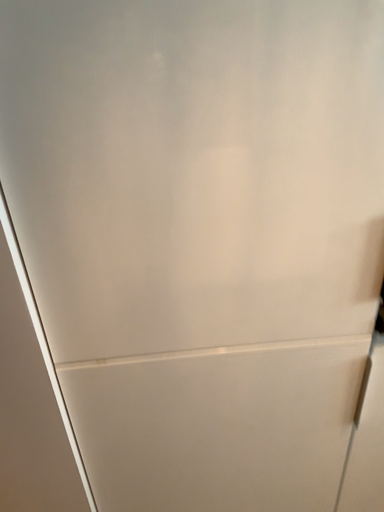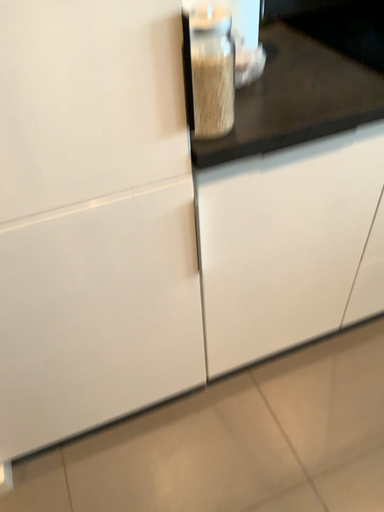
Question: Which way did the camera rotate in the video?

Choices:
 (A) rotated right
 (B) rotated left

Answer: (A)